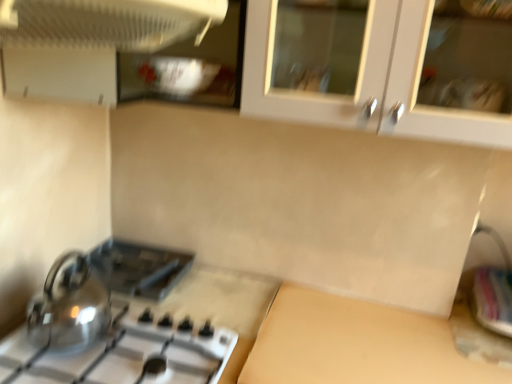
Question: In terms of width, does shiny metallic gas stove at lower left look wider or thinner when compared to white plastic fan at upper left, the 1th kitchen appliance viewed from the top?

Choices:
 (A) thin
 (B) wide

Answer: (B)

Question: From the image's perspective, is shiny metallic gas stove at lower left positioned above or below white plastic fan at upper left, which ranks as the second kitchen appliance in bottom-to-top order?

Choices:
 (A) below
 (B) above

Answer: (A)

Question: Which of these objects is positioned farthest from the beige matte counter top at lower center?

Choices:
 (A) metallic silver sink at lower right
 (B) white plastic fan at upper left, which ranks as the second kitchen appliance in bottom-to-top order
 (C) shiny metallic gas stove at lower left
 (D) black plastic toaster at lower left
 (E) shiny metallic kettle at lower left, which is counted as the second kitchen appliance, starting from the front

Answer: (B)

Question: Based on their relative distances, which object is nearer to the shiny metallic kettle at lower left, which is counted as the second kitchen appliance, starting from the front?

Choices:
 (A) white plastic fan at upper left, which ranks as the second kitchen appliance in bottom-to-top order
 (B) black plastic toaster at lower left
 (C) shiny metallic gas stove at lower left
 (D) metallic silver sink at lower right
 (E) beige matte counter top at lower center

Answer: (C)